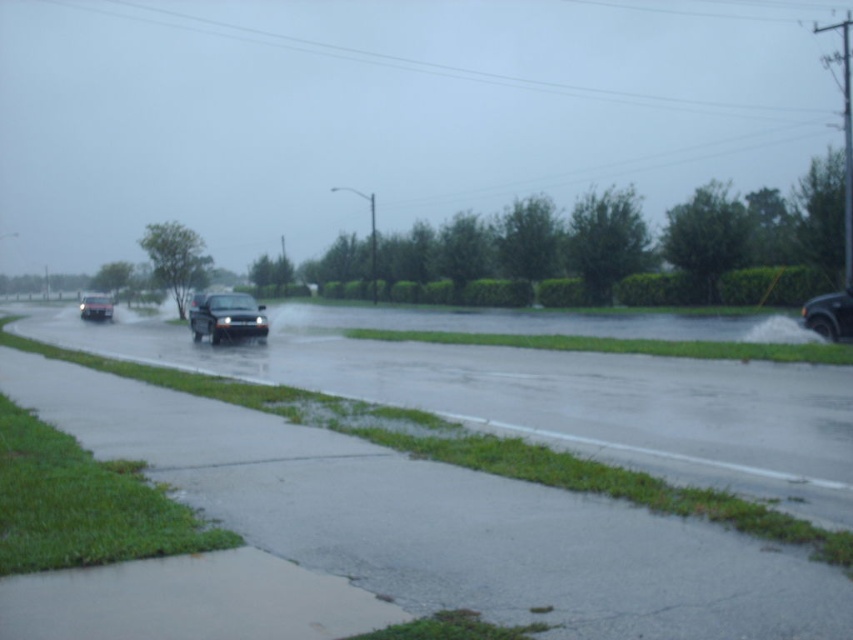
Looking at this image, you are a pedestrian trying to cross the road safely. You see the metallic silver suv at lower right and the matte black truck at center. Which vehicle is shorter in height?

The metallic silver suv at lower right has a lesser height compared to the matte black truck at center, so the metallic silver suv at lower right is shorter in height.

You are a pedestrian trying to cross the road safely. You see the smokey gray metallic car at center and the metallic silver suv at lower right. Which vehicle is closer to the left side of the road?

The smokey gray metallic car at center is closer to the left side of the road because it is positioned to the left of the metallic silver suv at lower right.